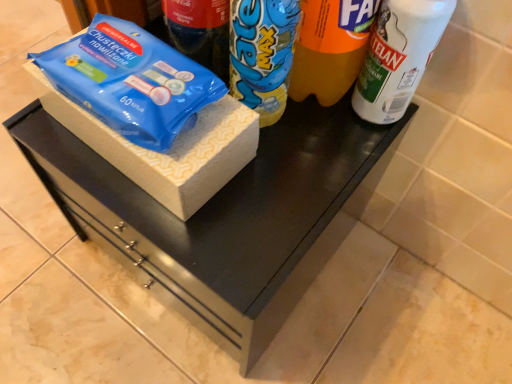
Locate an element on the screen. The image size is (512, 384). vacant region to the right of wooden box at center is located at coordinates (291, 189).